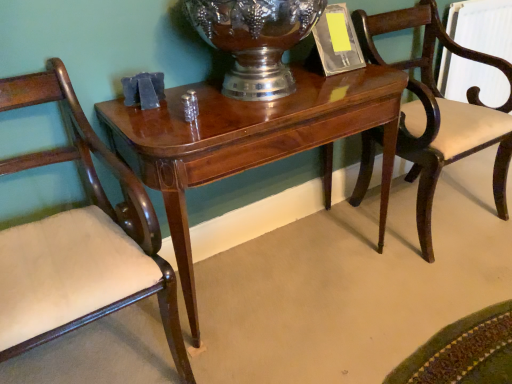
The height and width of the screenshot is (384, 512). What are the coordinates of `vacant space underneath shiny silver vase at center (from a real-world perspective)` in the screenshot? It's located at (250, 99).